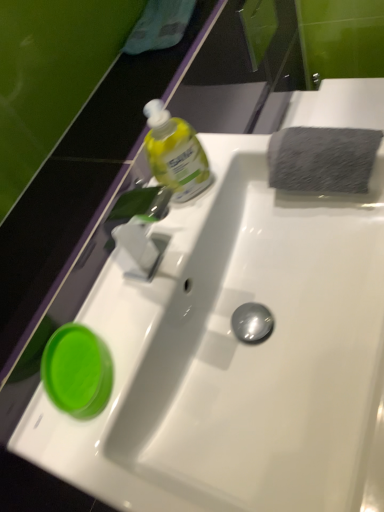
Identify the location of vacant area located to the right-hand side of green glossy cup at lower left. point(142,307).